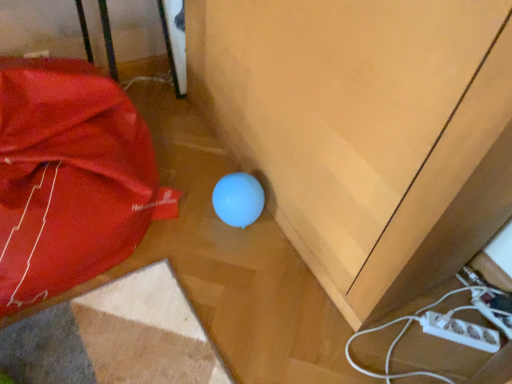
At what (x,y) coordinates should I click in order to perform the action: click on matte red umbrella at lower left. Please return your answer as a coordinate pair (x, y). The height and width of the screenshot is (384, 512). Looking at the image, I should click on (70, 178).

What do you see at coordinates (70, 178) in the screenshot? This screenshot has height=384, width=512. I see `matte red umbrella at lower left` at bounding box center [70, 178].

The height and width of the screenshot is (384, 512). What are the coordinates of `matte wood cabinet at center` in the screenshot? It's located at (365, 130).

What is the approximate width of matte wood cabinet at center?

matte wood cabinet at center is 17.23 inches in width.

What do you see at coordinates (365, 130) in the screenshot?
I see `matte wood cabinet at center` at bounding box center [365, 130].

Where is `matte red umbrella at lower left`? matte red umbrella at lower left is located at coordinates (70, 178).

Can you confirm if matte wood cabinet at center is positioned to the left of matte red umbrella at lower left?

In fact, matte wood cabinet at center is to the right of matte red umbrella at lower left.

Is the depth of matte wood cabinet at center greater than that of matte red umbrella at lower left?

No, matte wood cabinet at center is closer to the camera.

Considering the points (511, 100) and (89, 96), which point is in front, point (511, 100) or point (89, 96)?

The point (511, 100) is closer.

From the image's perspective, would you say matte wood cabinet at center is positioned over matte red umbrella at lower left?

Yes, from the image's perspective, matte wood cabinet at center is over matte red umbrella at lower left.

From a real-world perspective, is matte wood cabinet at center physically located above or below matte red umbrella at lower left?

matte wood cabinet at center is situated higher than matte red umbrella at lower left in the real world.

Considering the relative sizes of matte wood cabinet at center and matte red umbrella at lower left in the image provided, is matte wood cabinet at center wider than matte red umbrella at lower left?

No, matte wood cabinet at center is not wider than matte red umbrella at lower left.

Is matte wood cabinet at center taller or shorter than matte red umbrella at lower left?

Clearly, matte wood cabinet at center is taller compared to matte red umbrella at lower left.

Who is smaller, matte wood cabinet at center or matte red umbrella at lower left?

matte red umbrella at lower left is smaller.

Looking at this image, is matte wood cabinet at center outside of matte red umbrella at lower left?

Yes, matte wood cabinet at center is not within matte red umbrella at lower left.

Is matte wood cabinet at center far away from matte red umbrella at lower left?

That's not correct — matte wood cabinet at center is a little close to matte red umbrella at lower left.

Is matte red umbrella at lower left at the back of matte wood cabinet at center?

No, matte wood cabinet at center's orientation is not away from matte red umbrella at lower left.

Find the location of a particular element. The width and height of the screenshot is (512, 384). furniture in front of the matte red umbrella at lower left is located at coordinates (365, 130).

Is matte red umbrella at lower left at the right side of matte wood cabinet at center?

In fact, matte red umbrella at lower left is to the left of matte wood cabinet at center.

Which object is further away from the camera, matte red umbrella at lower left or matte wood cabinet at center?

matte red umbrella at lower left is behind.

Is point (34, 149) farther from camera compared to point (257, 60)?

No.

From the image's perspective, is matte red umbrella at lower left located beneath matte wood cabinet at center?

Yes.

From a real-world perspective, which is physically above, matte red umbrella at lower left or matte wood cabinet at center?

matte wood cabinet at center is physically above.

Between matte red umbrella at lower left and matte wood cabinet at center, which one has smaller width?

With smaller width is matte wood cabinet at center.

Considering the sizes of matte red umbrella at lower left and matte wood cabinet at center in the image, is matte red umbrella at lower left taller or shorter than matte wood cabinet at center?

matte red umbrella at lower left is shorter than matte wood cabinet at center.

Does matte red umbrella at lower left have a smaller size compared to matte wood cabinet at center?

Indeed, matte red umbrella at lower left has a smaller size compared to matte wood cabinet at center.

Is matte red umbrella at lower left outside of matte wood cabinet at center?

Yes, matte red umbrella at lower left is not within matte wood cabinet at center.

Would you say matte red umbrella at lower left is a long distance from matte wood cabinet at center?

No, there isn't a large distance between matte red umbrella at lower left and matte wood cabinet at center.

Is matte wood cabinet at center at the back of matte red umbrella at lower left?

No, matte wood cabinet at center is not at the back of matte red umbrella at lower left.

How different are the orientations of matte red umbrella at lower left and matte wood cabinet at center in degrees?

They differ by 91.5 degrees in their facing directions.

How far apart are matte red umbrella at lower left and matte wood cabinet at center?

matte red umbrella at lower left and matte wood cabinet at center are 53.00 centimeters apart.

At what (x,y) coordinates should I click in order to perform the action: click on furniture on the right of matte red umbrella at lower left. Please return your answer as a coordinate pair (x, y). Looking at the image, I should click on pyautogui.click(x=365, y=130).

The width and height of the screenshot is (512, 384). Identify the location of umbrella located underneath the matte wood cabinet at center (from a real-world perspective). [70, 178].

Where is `umbrella on the left of matte wood cabinet at center`? umbrella on the left of matte wood cabinet at center is located at coordinates (70, 178).